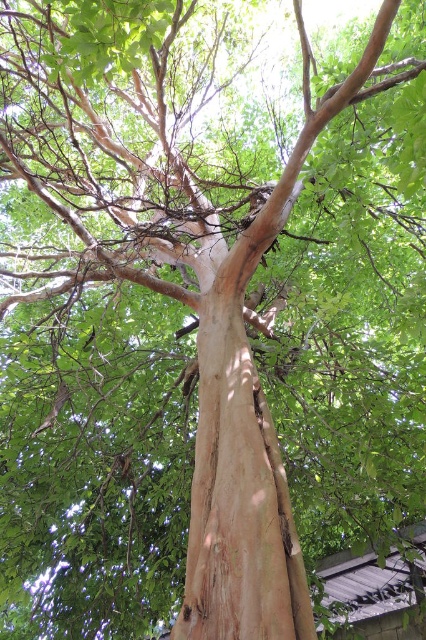
You are examining a tree trunk and notice two distinct sections of bark. One is a smooth bark branch at center and the other is a light brown rough bark at center. Which section of bark is located to the left when viewed from the front of the tree?

The smooth bark branch at center is positioned on the left side of light brown rough bark at center, so the smooth bark branch at center is located to the left.

You are an arborist examining the tree. You notice the smooth bark branch at center and the light brown rough bark at center. Which one is taller?

The smooth bark branch at center is taller than the light brown rough bark at center.